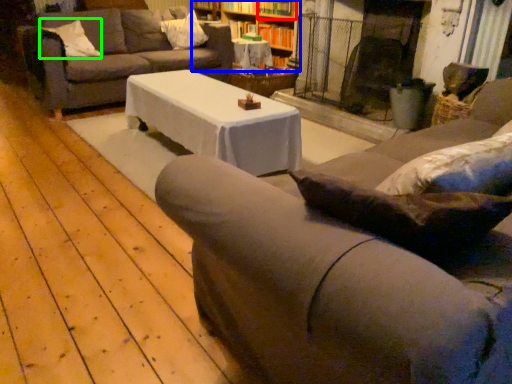
Question: Based on their relative distances, which object is farther from shelf (highlighted by a red box)? Choose from bookcase (highlighted by a blue box) and pillow (highlighted by a green box).

Choices:
 (A) bookcase
 (B) pillow

Answer: (B)